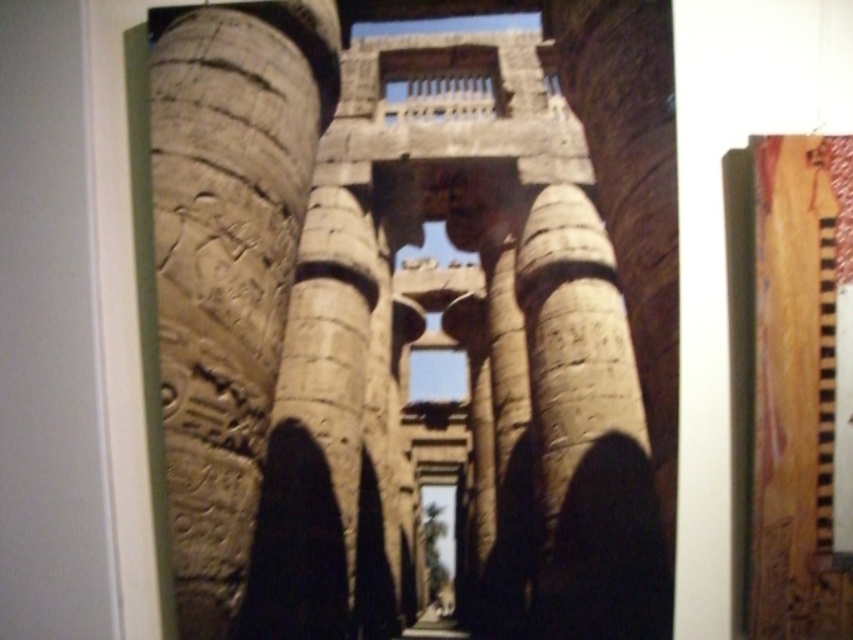
Question: Can you confirm if carved stone columns at center is bigger than carved stone column at left?

Choices:
 (A) no
 (B) yes

Answer: (B)

Question: Is carved stone columns at center below carved stone column at center?

Choices:
 (A) no
 (B) yes

Answer: (A)

Question: Does carved stone columns at center come behind carved stone column at center?

Choices:
 (A) yes
 (B) no

Answer: (A)

Question: Which of the following is the closest to the observer?

Choices:
 (A) (253, 280)
 (B) (624, 609)
 (C) (595, 388)

Answer: (B)

Question: Among these objects, which one is farthest from the camera?

Choices:
 (A) carved stone column at left
 (B) carved stone columns at center
 (C) carved stone column at center

Answer: (A)

Question: Estimate the real-world distances between objects in this image. Which object is farther from the carved stone column at center?

Choices:
 (A) carved stone column at left
 (B) carved stone columns at center

Answer: (A)